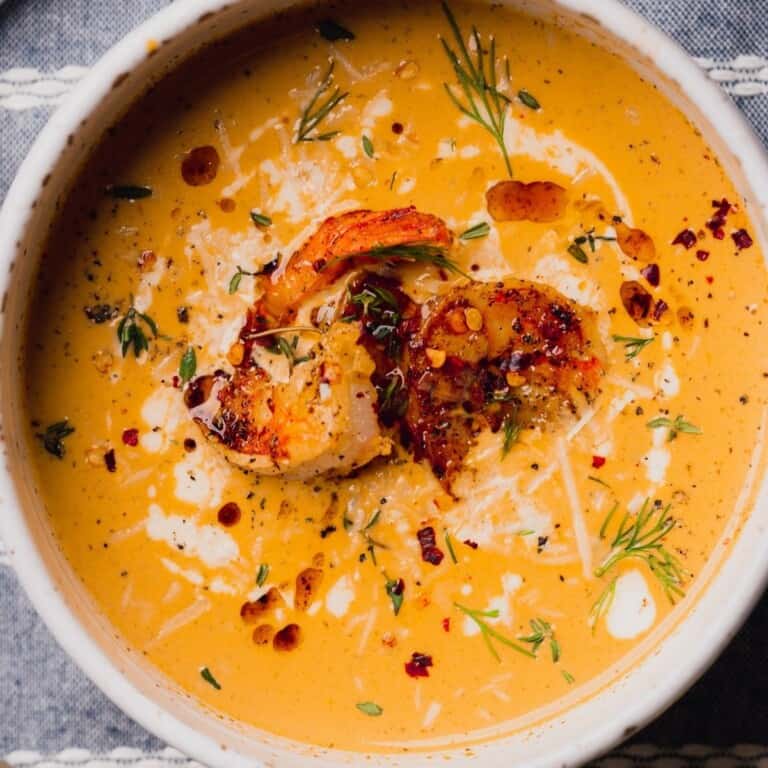
Identify the location of bowl shadow. (157, 100).